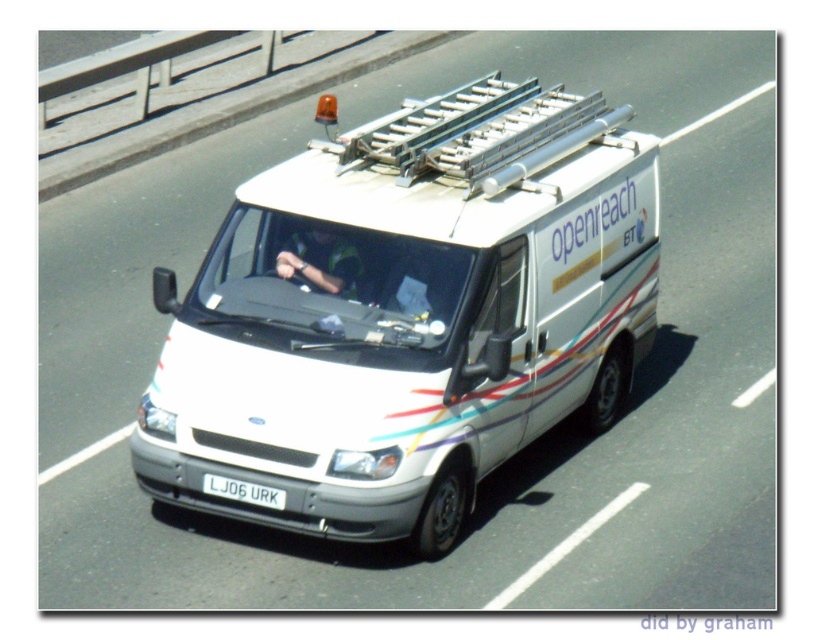
Question: Estimate the real-world distances between objects in this image. Which object is closer to the white matte van at center?

Choices:
 (A) green fabric shirt at center
 (B) white plastic license plate at center

Answer: (A)

Question: Considering the relative positions of white matte van at center and white plastic license plate at center in the image provided, where is white matte van at center located with respect to white plastic license plate at center?

Choices:
 (A) below
 (B) above

Answer: (B)

Question: Which of the following is the closest to the observer?

Choices:
 (A) (322, 266)
 (B) (567, 348)
 (C) (263, 492)

Answer: (C)

Question: Is white matte van at center above green fabric shirt at center?

Choices:
 (A) no
 (B) yes

Answer: (A)

Question: Does white matte van at center have a smaller size compared to white plastic license plate at center?

Choices:
 (A) yes
 (B) no

Answer: (B)

Question: Estimate the real-world distances between objects in this image. Which object is closer to the green fabric shirt at center?

Choices:
 (A) white plastic license plate at center
 (B) white matte van at center

Answer: (B)